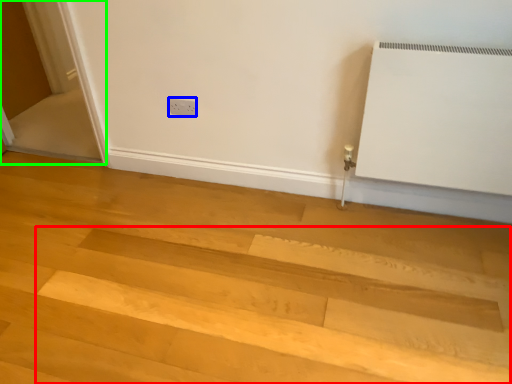
Question: Which is nearer to the stairwell (highlighted by a red box)? electric outlet (highlighted by a blue box) or screen door (highlighted by a green box).

Choices:
 (A) electric outlet
 (B) screen door

Answer: (A)